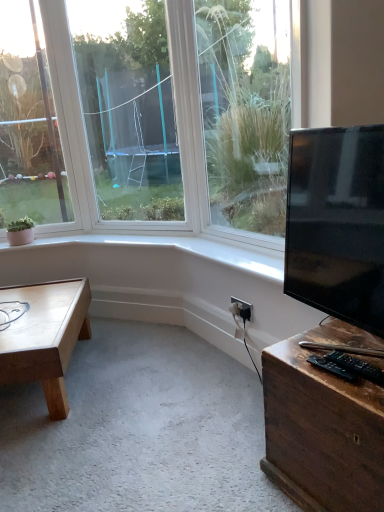
At what (x,y) coordinates should I click in order to perform the action: click on free location above wooden desk at lower right (from a real-world perspective). Please return your answer as a coordinate pair (x, y). Looking at the image, I should click on (336, 348).